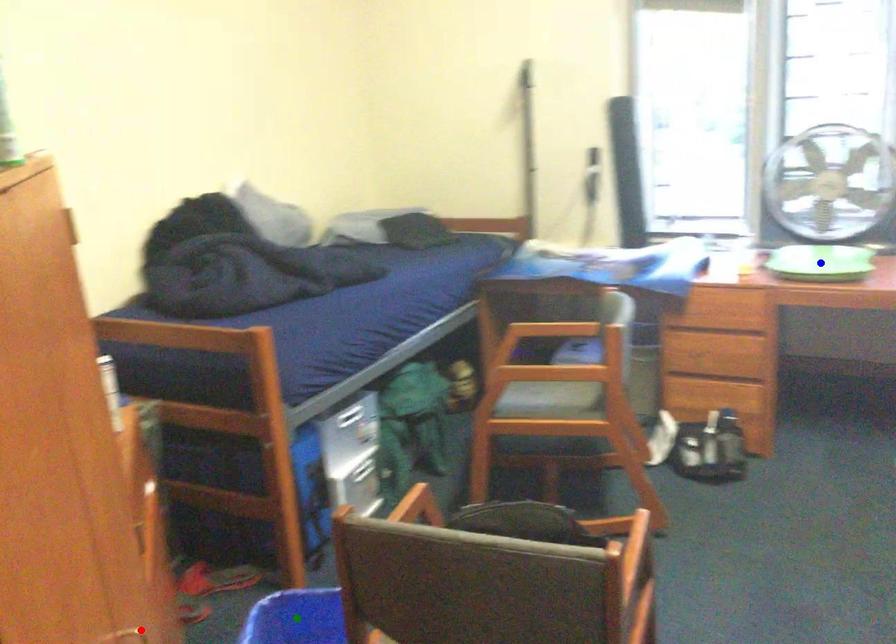
Order these from nearest to farthest:
A) green point
B) blue point
C) red point

red point
green point
blue point